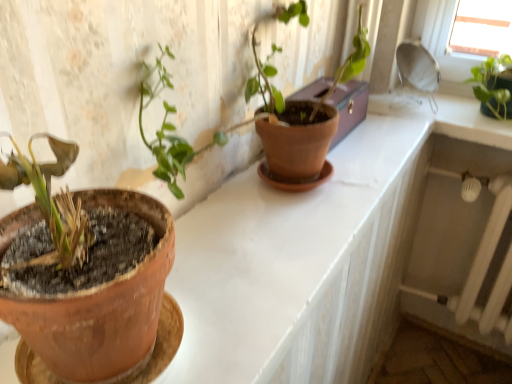
Locate an element on the screen. This screenshot has width=512, height=384. matte terracotta pot at center is located at coordinates (338, 192).

Locate an element on the screen. brown leather box at upper center is located at coordinates (349, 107).

Image resolution: width=512 pixels, height=384 pixels. What are the coordinates of `green matte plant at upper right` in the screenshot? It's located at (490, 84).

Image resolution: width=512 pixels, height=384 pixels. In order to click on houseplant above the brown leather box at upper center (from a real-world perspective) in this screenshot , I will do `click(490, 84)`.

Considering their positions, is green matte plant at upper right located in front of or behind brown leather box at upper center?

In the image, green matte plant at upper right appears behind brown leather box at upper center.

Can you tell me how much green matte plant at upper right and brown leather box at upper center differ in facing direction?

88.2 degrees separate the facing orientations of green matte plant at upper right and brown leather box at upper center.

Which of these two, green matte plant at upper right or brown leather box at upper center, is bigger?

With larger size is green matte plant at upper right.

Does terracotta clay pot at left have a larger size compared to brown leather box at upper center?

Yes.

From the picture: Is brown leather box at upper center at the back of terracotta clay pot at left?

No, brown leather box at upper center is not at the back of terracotta clay pot at left.

Is brown leather box at upper center a part of terracotta clay pot at left?

Actually, brown leather box at upper center is outside terracotta clay pot at left.

How much distance is there between terracotta clay pot at left and brown leather box at upper center?

terracotta clay pot at left is 27.46 inches away from brown leather box at upper center.

In terms of width, does terracotta clay pot at left look wider or thinner when compared to green matte plant at upper right?

In the image, terracotta clay pot at left appears to be more narrow than green matte plant at upper right.

You are a GUI agent. You are given a task and a screenshot of the screen. Output one action in this format:
    pyautogui.click(x=<x>, y=<y>)
    Task: Click on the houseplant that is under the terracotta clay pot at left (from a real-world perspective)
    The height and width of the screenshot is (384, 512).
    Given the screenshot: What is the action you would take?
    pos(490,84)

Between terracotta clay pot at left and green matte plant at upper right, which one has larger size?

With larger size is terracotta clay pot at left.

Does point (1, 244) come closer to viewer compared to point (503, 105)?

Yes.

Between point (243, 264) and point (479, 96), which one is positioned behind?

The point (479, 96) is farther from the camera.

Is matte terracotta pot at center wider or thinner than green matte plant at upper right?

In the image, matte terracotta pot at center appears to be wider than green matte plant at upper right.

Is the depth of matte terracotta pot at center greater than that of green matte plant at upper right?

No, matte terracotta pot at center is in front of green matte plant at upper right.

Would you say matte terracotta pot at center is a long distance from green matte plant at upper right?

No, matte terracotta pot at center is not far away from green matte plant at upper right.

From their relative heights in the image, would you say brown leather box at upper center is taller or shorter than green matte plant at upper right?

Clearly, brown leather box at upper center is shorter compared to green matte plant at upper right.

Are brown leather box at upper center and green matte plant at upper right beside each other?

They are not placed beside each other.

Is brown leather box at upper center positioned with its back to green matte plant at upper right?

That's not correct — brown leather box at upper center is not looking away from green matte plant at upper right.

Would you say brown leather box at upper center is to the left or to the right of green matte plant at upper right in the picture?

brown leather box at upper center is positioned on green matte plant at upper right's left side.

Which is less distant, (496, 97) or (150, 290)?

Point (496, 97).

Does green matte plant at upper right have a lesser height compared to terracotta clay pot at left?

Correct, green matte plant at upper right is not as tall as terracotta clay pot at left.

How different are the orientations of green matte plant at upper right and terracotta clay pot at left in degrees?

The angular difference between green matte plant at upper right and terracotta clay pot at left is 86.8 degrees.

How far apart are green matte plant at upper right and terracotta clay pot at left?

The distance of green matte plant at upper right from terracotta clay pot at left is 1.15 meters.

From a real-world perspective, which is physically above, green matte plant at upper right or matte terracotta pot at center?

From a 3D spatial view, green matte plant at upper right is above.

At what (x,y) coordinates should I click in order to perform the action: click on houseplant above the matte terracotta pot at center (from the image's perspective). Please return your answer as a coordinate pair (x, y). The image size is (512, 384). Looking at the image, I should click on (490, 84).

How different are the orientations of green matte plant at upper right and matte terracotta pot at center in degrees?

green matte plant at upper right and matte terracotta pot at center are facing 1.14 degrees away from each other.

Is green matte plant at upper right far from matte terracotta pot at center?

No, green matte plant at upper right is not far from matte terracotta pot at center.

The height and width of the screenshot is (384, 512). I want to click on window box that appears in front of the green matte plant at upper right, so click(349, 107).

In order to click on window box above the terracotta clay pot at left (from the image's perspective) in this screenshot , I will do `click(349, 107)`.

Considering their positions, is green matte plant at upper right positioned closer to terracotta clay pot at left than matte terracotta pot at center?

The object closer to terracotta clay pot at left is matte terracotta pot at center.

When comparing their distances from green matte plant at upper right, does terracotta clay pot at left or brown leather box at upper center seem closer?

brown leather box at upper center is closer to green matte plant at upper right.

Estimate the real-world distances between objects in this image. Which object is further from green matte plant at upper right, matte terracotta pot at center or terracotta clay pot at left?

terracotta clay pot at left is positioned further to the anchor green matte plant at upper right.

Looking at the image, which one is located closer to brown leather box at upper center, terracotta clay pot at left or green matte plant at upper right?

The object closer to brown leather box at upper center is green matte plant at upper right.

Based on their spatial positions, is matte terracotta pot at center or brown leather box at upper center further from terracotta clay pot at left?

brown leather box at upper center is positioned further to the anchor terracotta clay pot at left.

From the image, which object appears to be farther from matte terracotta pot at center, terracotta clay pot at left or brown leather box at upper center?

terracotta clay pot at left is further to matte terracotta pot at center.

Based on their spatial positions, is green matte plant at upper right or brown leather box at upper center further from matte terracotta pot at center?

The object further to matte terracotta pot at center is green matte plant at upper right.

Which object lies nearer to the anchor point green matte plant at upper right, brown leather box at upper center or terracotta clay pot at left?

brown leather box at upper center is closer to green matte plant at upper right.

Where is `counter between terracotta clay pot at left and brown leather box at upper center along the z-axis`? counter between terracotta clay pot at left and brown leather box at upper center along the z-axis is located at coordinates tap(338, 192).

Image resolution: width=512 pixels, height=384 pixels. I want to click on window box between terracotta clay pot at left and green matte plant at upper right in the horizontal direction, so click(349, 107).

Locate an element on the screen. window box between matte terracotta pot at center and green matte plant at upper right along the z-axis is located at coordinates (349, 107).

Where is `counter between terracotta clay pot at left and green matte plant at upper right in the horizontal direction`? counter between terracotta clay pot at left and green matte plant at upper right in the horizontal direction is located at coordinates (338, 192).